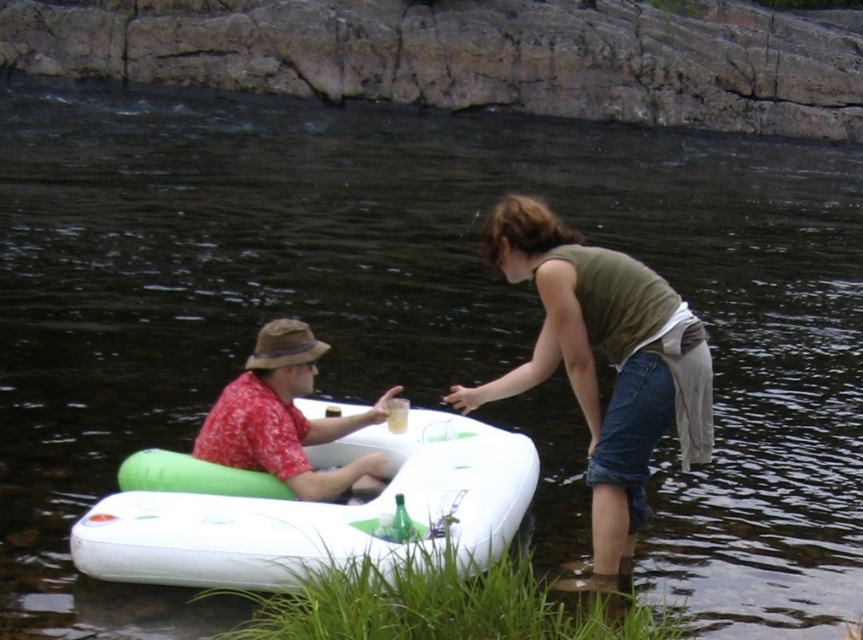
Is white rubber boat at center bigger than red floral shirt at center?

Yes, white rubber boat at center is bigger than red floral shirt at center.

Is the position of white rubber boat at center less distant than that of red floral shirt at center?

That is True.

Between point (483, 497) and point (225, 428), which one is positioned in front?

Point (483, 497)

I want to click on white rubber boat at center, so click(307, 509).

Is green fabric shirt at center positioned at the back of red floral shirt at center?

No, green fabric shirt at center is in front of red floral shirt at center.

Is green fabric shirt at center taller than red floral shirt at center?

Indeed, green fabric shirt at center has a greater height compared to red floral shirt at center.

Who is more distant from viewer, (483, 388) or (295, 422)?

The point (295, 422) is more distant.

Where is `green fabric shirt at center`? The image size is (863, 640). green fabric shirt at center is located at coordinates (608, 356).

Can you confirm if white rubber boat at center is smaller than green fabric shirt at center?

No.

Who is more distant from viewer, [219,556] or [580,408]?

The point [580,408] is more distant.

The width and height of the screenshot is (863, 640). Identify the location of white rubber boat at center. (307, 509).